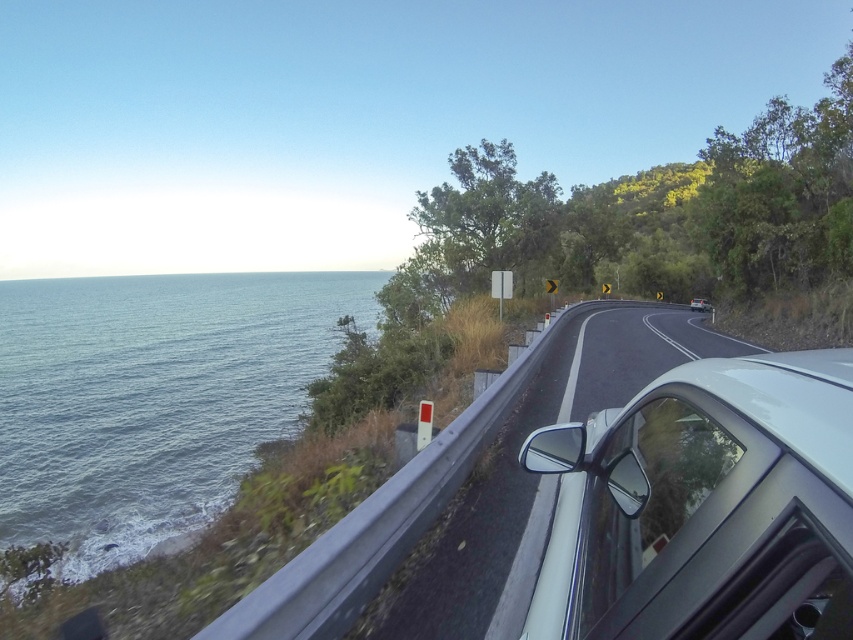
You are driving on a coastal road and see a point marked at coordinates (704, 506). According to the image description, what object is located at that point?

The point at coordinates (704, 506) indicates the location of the white glossy car at right.